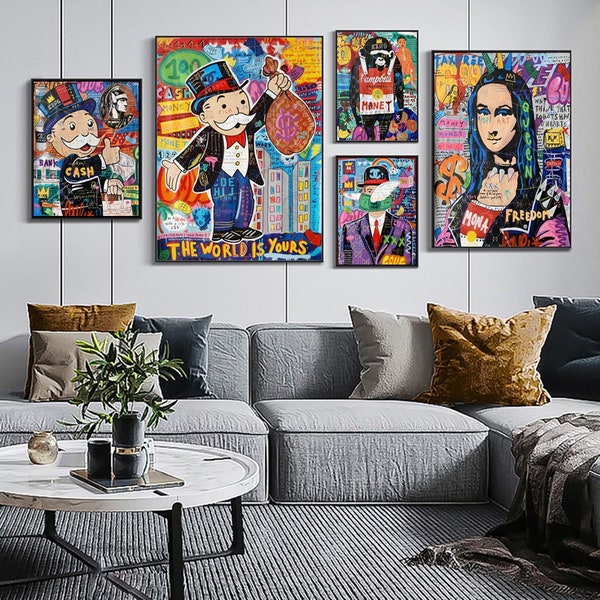
Where is `frames`? frames is located at coordinates (86, 78), (234, 35), (377, 28), (373, 156), (464, 50).